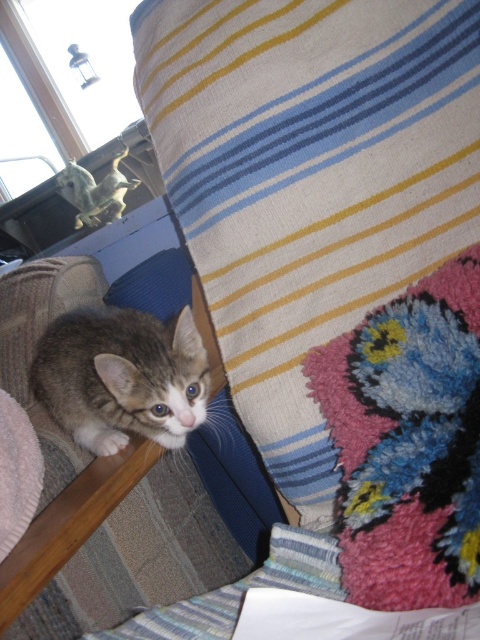
Consider the image. Between striped woolen blanket at upper right and tabby fur cat at lower left, which one has less height?

Standing shorter between the two is tabby fur cat at lower left.

Who is lower down, striped woolen blanket at upper right or tabby fur cat at lower left?

tabby fur cat at lower left is lower down.

Is point (422, 13) positioned before point (62, 396)?

Yes.

Where is `striped woolen blanket at upper right`? striped woolen blanket at upper right is located at coordinates (310, 182).